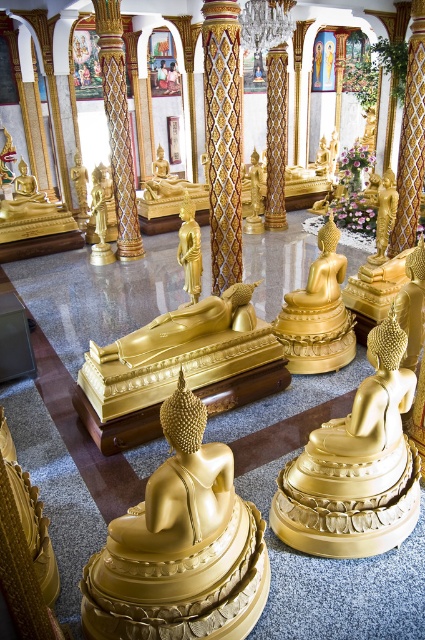
Between point (119, 164) and point (73, 161), which one is positioned in front?

Point (119, 164) is more forward.

Image resolution: width=425 pixels, height=640 pixels. What are the coordinates of `gold textured pillar at center` in the screenshot? It's located at (118, 125).

This screenshot has width=425, height=640. In order to click on gold textured pillar at center in this screenshot , I will do `click(118, 125)`.

This screenshot has width=425, height=640. What are the coordinates of `gold textured pillar at center` in the screenshot? It's located at (118, 125).

Between point (158, 618) and point (85, 202), which one is positioned behind?

Point (85, 202)

Is point (124, 616) closer to camera compared to point (79, 160)?

Yes, it is in front of point (79, 160).

You are a GUI agent. You are given a task and a screenshot of the screen. Output one action in this format:
    pyautogui.click(x=<x>, y=<y>)
    Task: Click on the gold shiny statue at center
    The width and height of the screenshot is (425, 640).
    Given the screenshot: What is the action you would take?
    pyautogui.click(x=181, y=547)

At what (x,y) coordinates should I click in order to perform the action: click on gold shiny statue at center. Please return your answer as a coordinate pair (x, y). Looking at the image, I should click on (181, 547).

Is point (110, 540) farther from camera compared to point (121, 125)?

No, it is in front of (121, 125).

Which is behind, point (107, 545) or point (130, 186)?

The point (130, 186) is behind.

Between point (181, 410) and point (116, 216), which one is positioned behind?

Positioned behind is point (116, 216).

What are the coordinates of `gold shiny statue at center` in the screenshot? It's located at (181, 547).